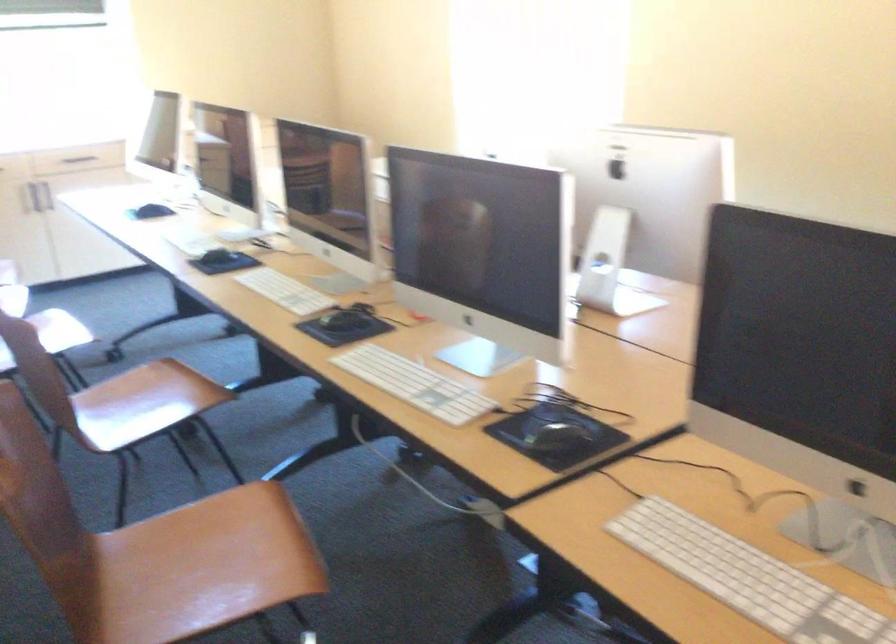
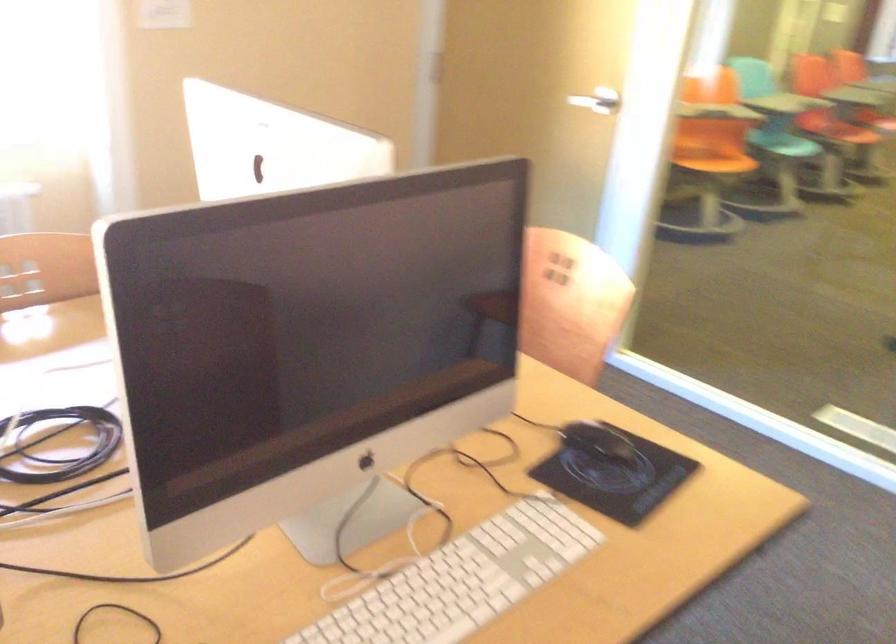
The images are taken continuously from a first-person perspective. In which direction is your viewpoint rotating?

The rotation direction of the camera is right-down.